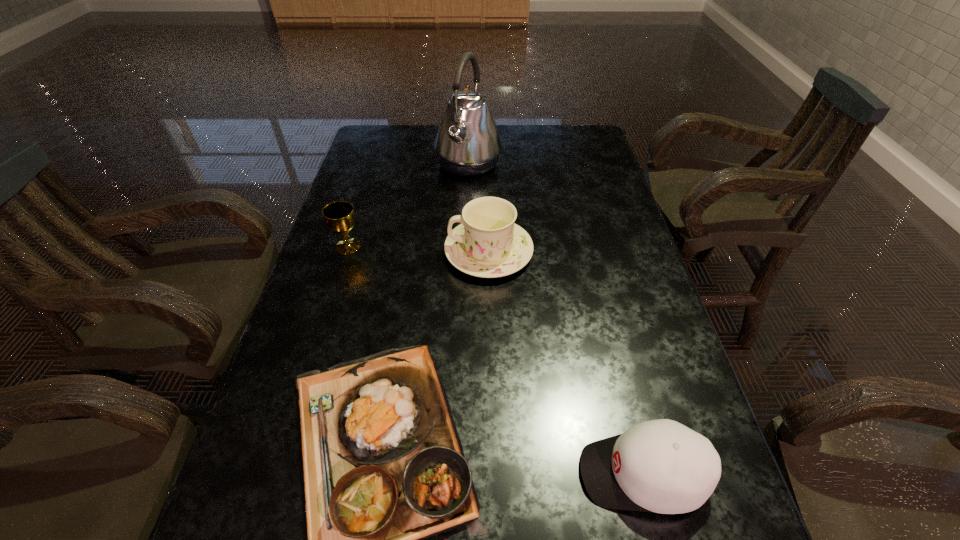
The height and width of the screenshot is (540, 960). Identify the location of free location that satisfies the following two spatial constraints: 1. on the back side of the tallest object; 2. on the right side of the chalice. (373, 164).

I want to click on free location that satisfies the following two spatial constraints: 1. on the back side of the kettle; 2. on the right side of the chalice, so click(x=373, y=164).